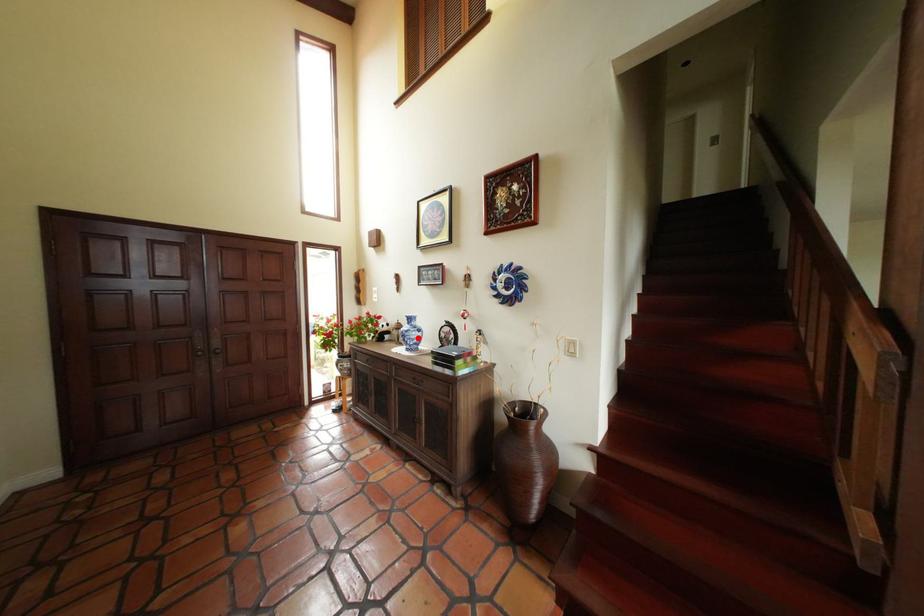
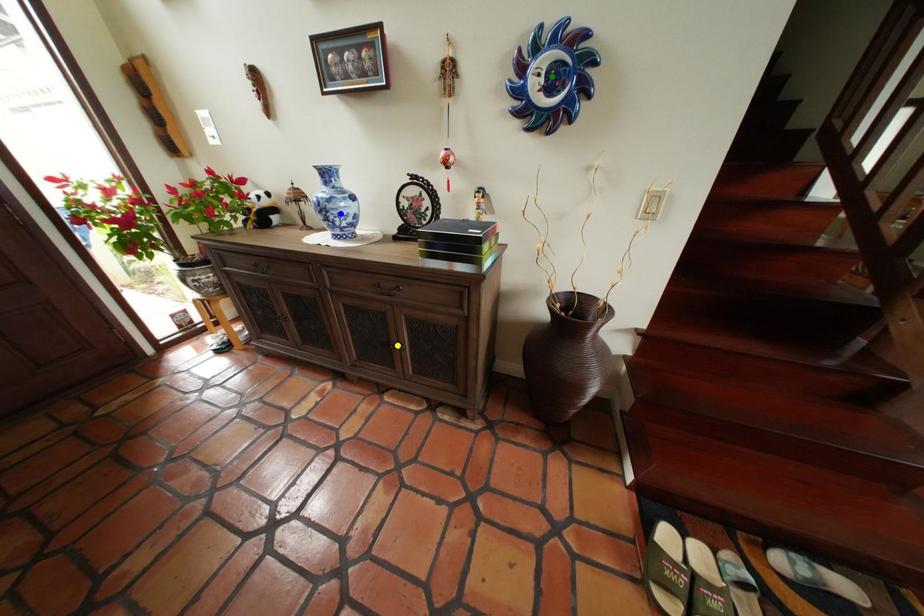
Question: I am providing you with two images of the same scene from different viewpoints. A red point is marked on the first image. You are given multiple points on the second image. Which spot in image 2 lines up with the point in image 1?

Choices:
 (A) yellow point
 (B) blue point
 (C) green point

Answer: (B)